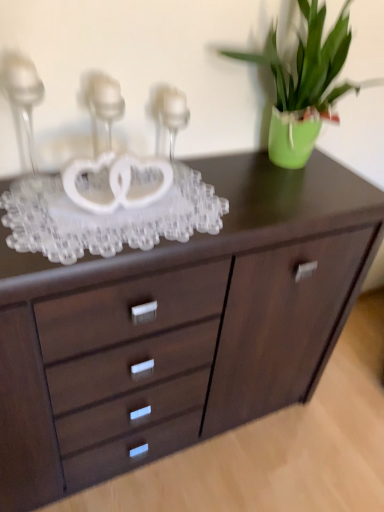
Question: In terms of size, does clear glass candle holder at upper left, acting as the 2th candle holder starting from the right, appear bigger or smaller than clear glass candle holder at center, placed as the first candle holder when sorted from right to left?

Choices:
 (A) small
 (B) big

Answer: (B)

Question: From the image's perspective, is clear glass candle holder at upper left, acting as the 2th candle holder starting from the right, above or below clear glass candle holder at center, placed as the first candle holder when sorted from right to left?

Choices:
 (A) above
 (B) below

Answer: (B)

Question: Estimate the real-world distances between objects in this image. Which object is closer to the dark wood chest of drawers at center?

Choices:
 (A) green matte vase at upper right
 (B) clear glass candle holder at center, placed as the 3th candle holder when sorted from left to right
 (C) clear glass candle holder at upper left, positioned as the third candle holder in right-to-left order
 (D) clear glass candle holder at upper left, acting as the 2th candle holder starting from the right

Answer: (A)

Question: Which object is positioned farthest from the green matte vase at upper right?

Choices:
 (A) clear glass candle holder at upper left, acting as the first candle holder starting from the left
 (B) clear glass candle holder at center, placed as the first candle holder when sorted from right to left
 (C) dark wood chest of drawers at center
 (D) clear glass candle holder at upper left, the 2th candle holder positioned from the left

Answer: (A)